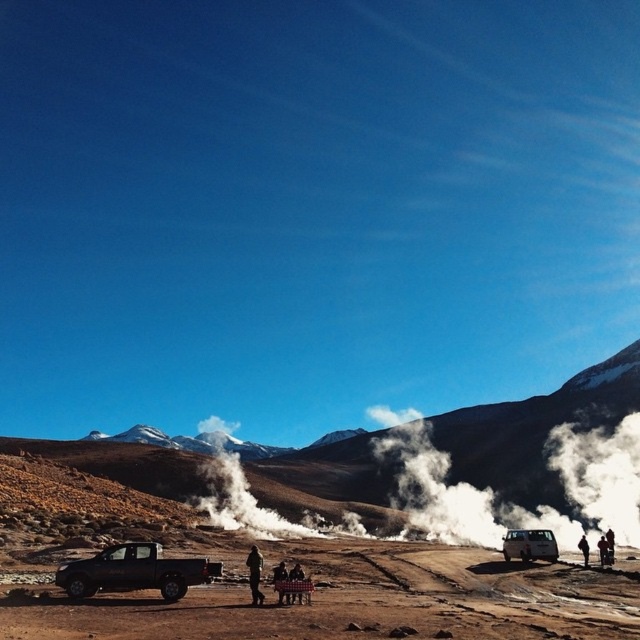
You are standing at the center of the dirt road and want to join the group near the small table. Which direction should you walk to reach the plaid fabric pants at center?

The plaid fabric pants at center is located at point (280, 572), so you should walk towards the center of the image to reach them.